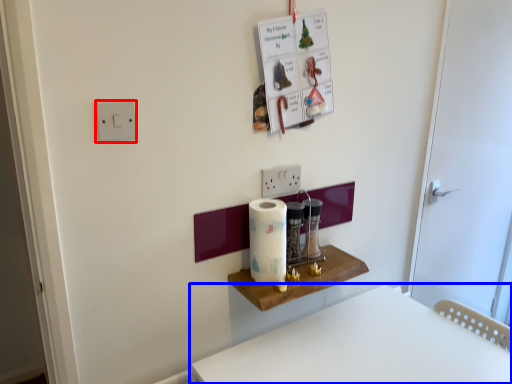
Question: Which object appears closest to the camera in this image, light switch (highlighted by a red box) or furniture (highlighted by a blue box)?

Choices:
 (A) light switch
 (B) furniture

Answer: (B)